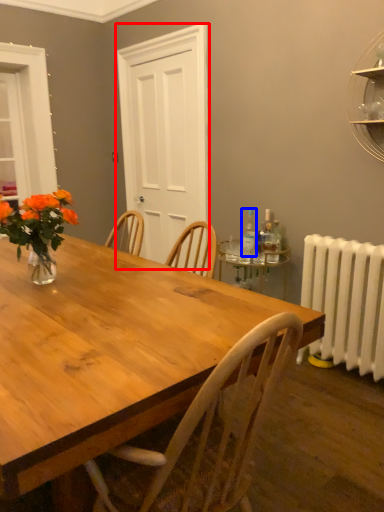
Question: Among these objects, which one is nearest to the camera, glass door (highlighted by a red box) or bottle (highlighted by a blue box)?

Choices:
 (A) glass door
 (B) bottle

Answer: (B)